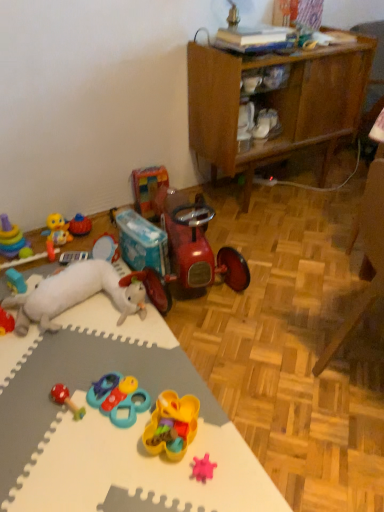
Where is `free space between translucent yellow plastic toy at center, the second toy in the right-to-left sequence, and white plush toy at upper left, the eighth toy when ordered from right to left`? The height and width of the screenshot is (512, 384). free space between translucent yellow plastic toy at center, the second toy in the right-to-left sequence, and white plush toy at upper left, the eighth toy when ordered from right to left is located at coordinates (116, 361).